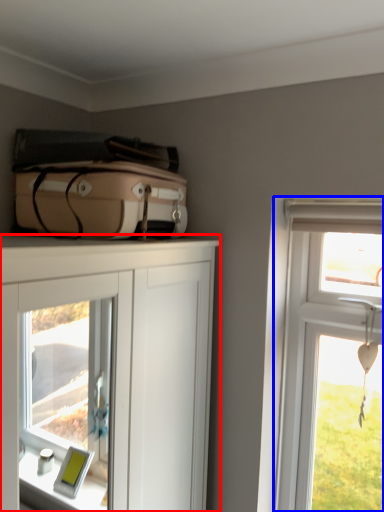
Question: Which object is further to the camera taking this photo, cabinetry (highlighted by a red box) or window (highlighted by a blue box)?

Choices:
 (A) cabinetry
 (B) window

Answer: (B)